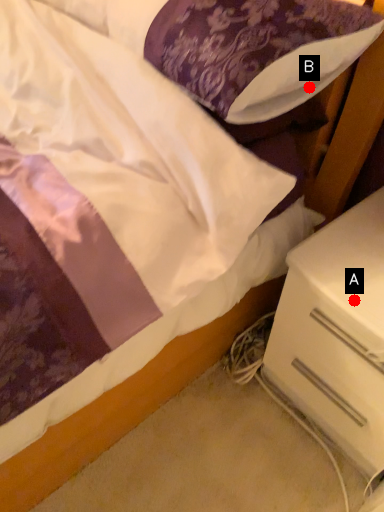
Question: Two points are circled on the image, labeled by A and B beside each circle. Among these points, which one is nearest to the camera?

Choices:
 (A) A is closer
 (B) B is closer

Answer: (A)